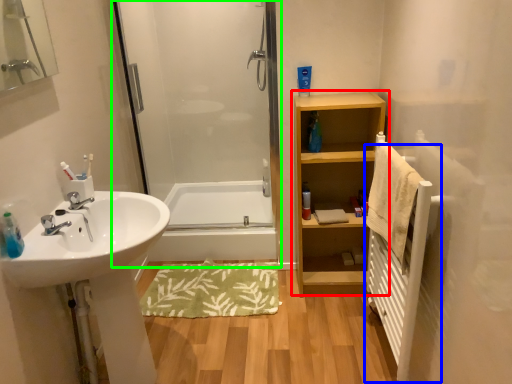
Question: Considering the real-world distances, which object is closest to bathroom cabinet (highlighted by a red box)? radiator (highlighted by a blue box) or screen door (highlighted by a green box).

Choices:
 (A) radiator
 (B) screen door

Answer: (A)